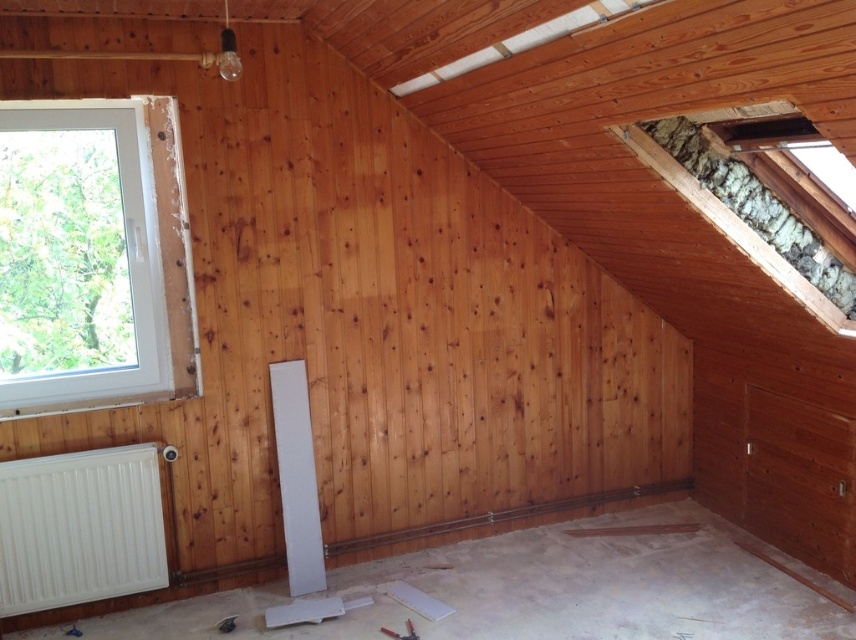
You are a GUI agent. You are given a task and a screenshot of the screen. Output one action in this format:
    pyautogui.click(x=<x>, y=<y>)
    Task: Click on the white plastic window at left
    
    Given the screenshot: What is the action you would take?
    pyautogui.click(x=91, y=253)

Between white plastic window at left and white matte beam at center, which one appears on the right side from the viewer's perspective?

From the viewer's perspective, white matte beam at center appears more on the right side.

Between point (3, 106) and point (290, 433), which one is positioned in front?

Positioned in front is point (3, 106).

I want to click on white plastic window at left, so click(x=91, y=253).

Who is positioned more to the right, white matte beam at center or metallic silver tool at lower center?

From the viewer's perspective, metallic silver tool at lower center appears more on the right side.

Identify the location of white matte beam at center. The height and width of the screenshot is (640, 856). (296, 477).

Where is `white matte beam at center`? The width and height of the screenshot is (856, 640). white matte beam at center is located at coordinates (296, 477).

Between point (84, 572) and point (402, 637), which one is positioned in front?

Point (402, 637) is in front.

Does white matte radiator at lower left have a lesser width compared to metallic silver tool at lower center?

No.

Is point (66, 598) farther from viewer compared to point (411, 625)?

Yes, point (66, 598) is behind point (411, 625).

Identify the location of white matte radiator at lower left. The image size is (856, 640). (79, 528).